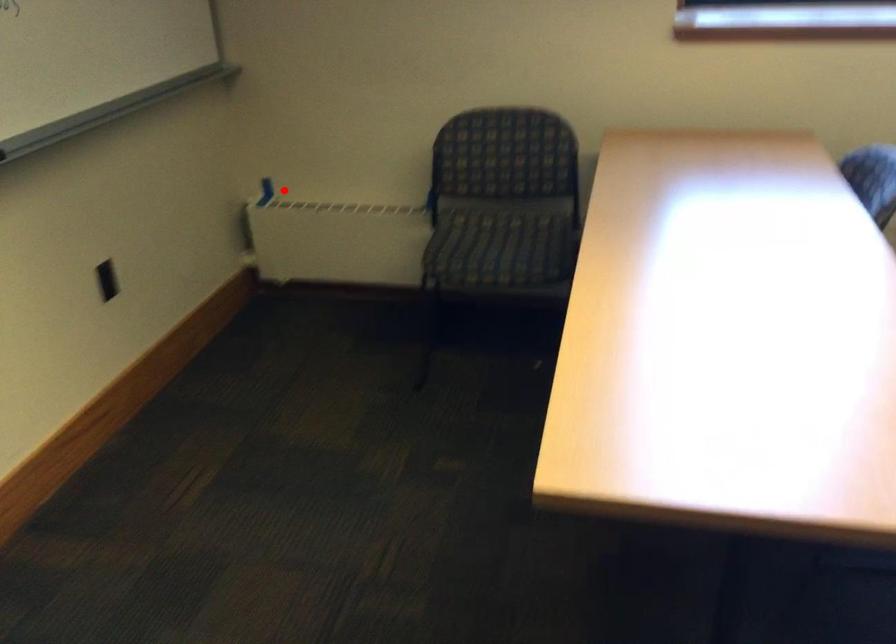
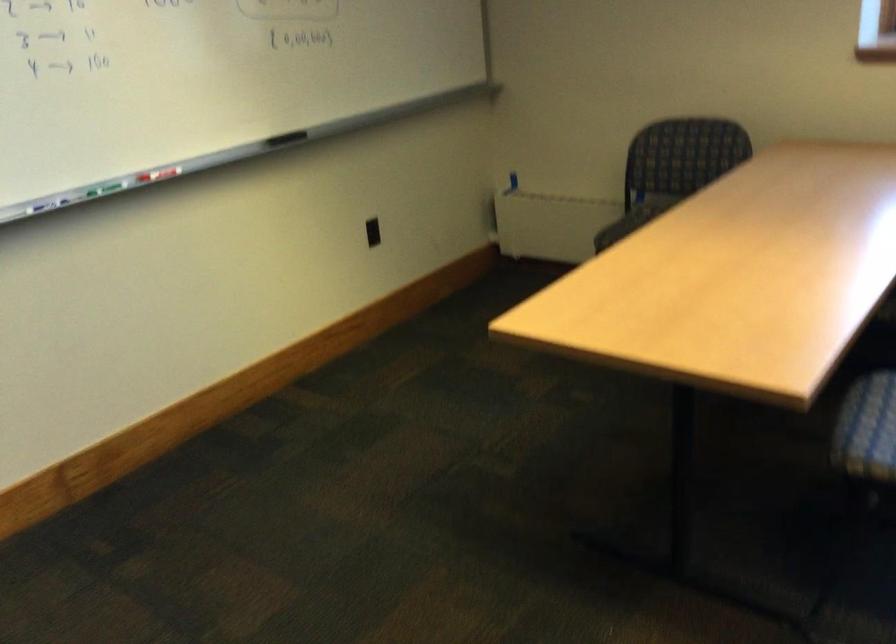
Question: I am providing you with two images of the same scene from different viewpoints. A red point is marked on the first image. Can you still see the location of the red point in image 2?

Choices:
 (A) Yes
 (B) No

Answer: (A)